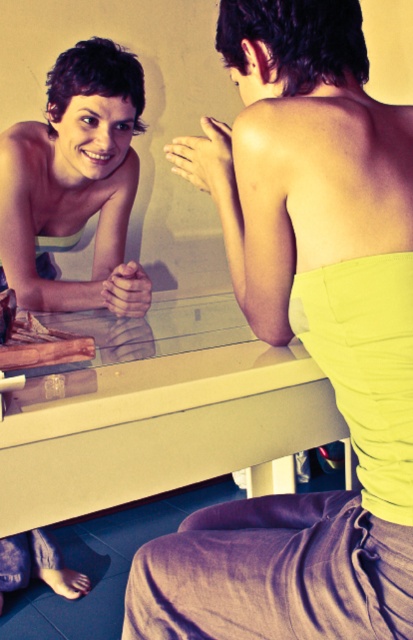
Is matte yellow strapless top at upper right closer to camera compared to matte glass table at center?

That is True.

Can you confirm if matte yellow strapless top at upper right is wider than matte glass table at center?

Incorrect, matte yellow strapless top at upper right's width does not surpass matte glass table at center's.

Find the location of `matte yellow strapless top at upper right`. matte yellow strapless top at upper right is located at coordinates (304, 337).

Looking at this image, is matte glass table at center smaller than matte white tank top at upper left?

No, matte glass table at center is not smaller than matte white tank top at upper left.

Which of these two, matte glass table at center or matte white tank top at upper left, stands shorter?

matte glass table at center

Find the location of a particular element. Image resolution: width=413 pixels, height=640 pixels. matte glass table at center is located at coordinates (161, 413).

Where is `matte glass table at center`? matte glass table at center is located at coordinates (161, 413).

Is matte yellow strapless top at upper right taller than matte white tank top at upper left?

Yes, matte yellow strapless top at upper right is taller than matte white tank top at upper left.

Between matte yellow strapless top at upper right and matte white tank top at upper left, which one has less height?

matte white tank top at upper left

Identify the location of matte yellow strapless top at upper right. (304, 337).

Identify the location of matte yellow strapless top at upper right. This screenshot has height=640, width=413. [x=304, y=337].